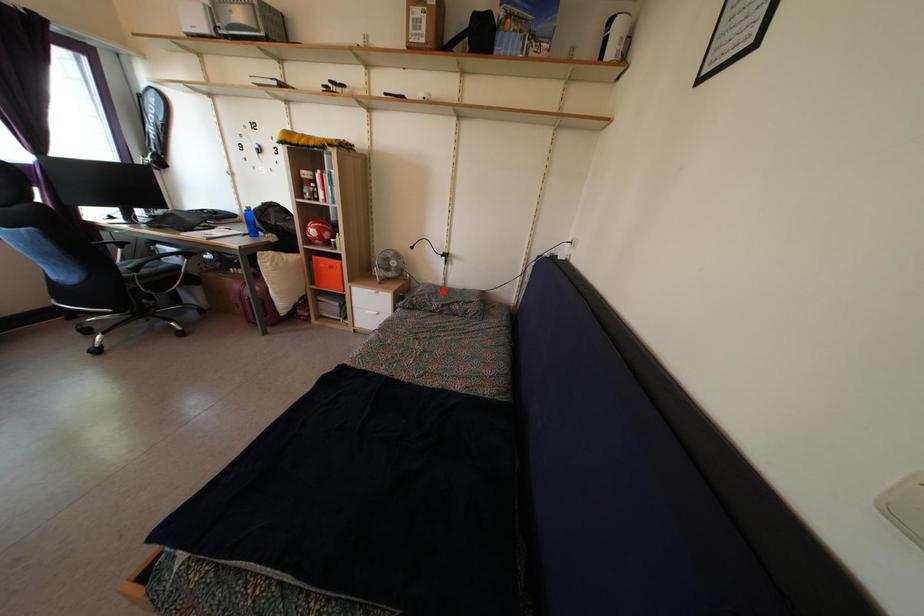
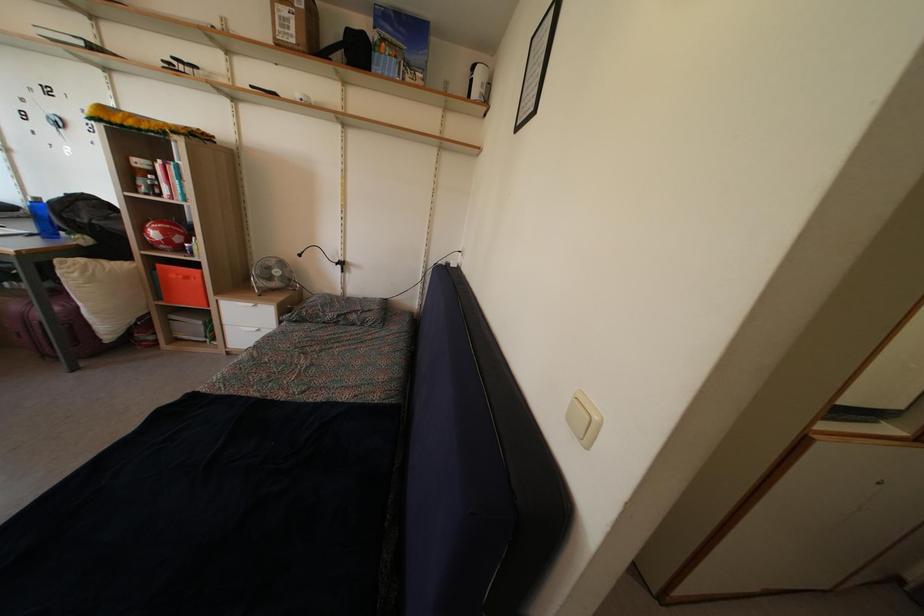
Find the pixel in the second image that matches the highlighted location in the first image.

(342, 301)